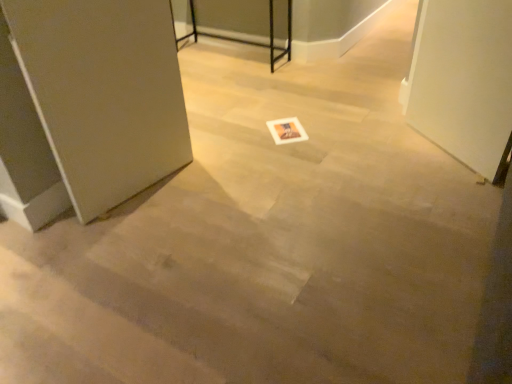
Where is `free space on the front side of satin silver door at left`? The height and width of the screenshot is (384, 512). free space on the front side of satin silver door at left is located at coordinates (113, 250).